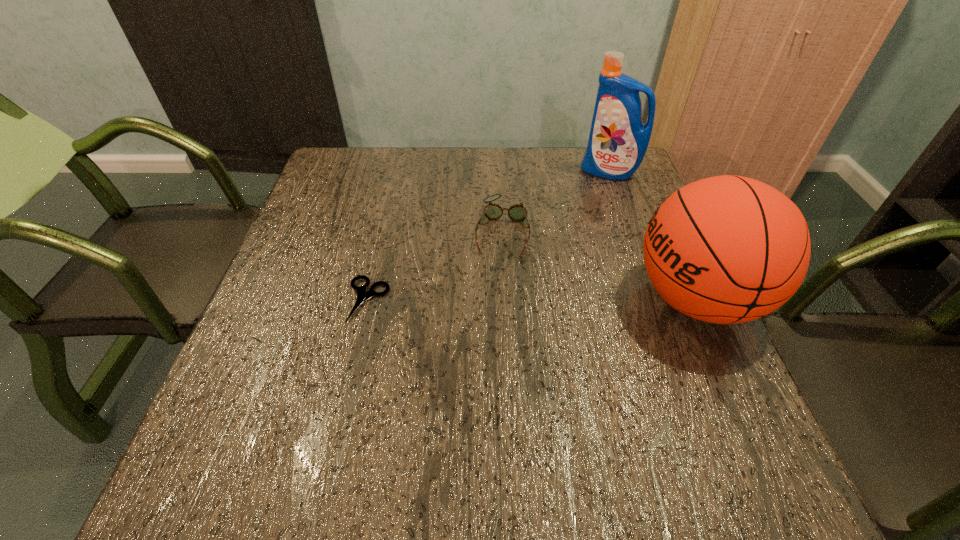
Find the location of a particular element. The image size is (960, 540). free spot on the desktop that is between the shears and the basketball and is positioned on the label of the farthest object is located at coordinates (493, 300).

This screenshot has width=960, height=540. Find the location of `vacant space on the desktop that is between the leftmost object and the basketball and is positioned on the front-facing side of the second shortest object`. vacant space on the desktop that is between the leftmost object and the basketball and is positioned on the front-facing side of the second shortest object is located at coordinates (492, 300).